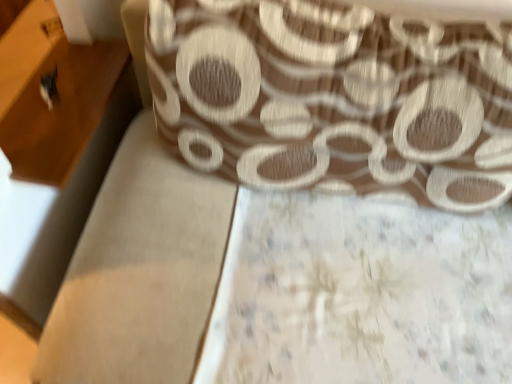
Question: From the image's perspective, is brown textured fabric at upper center located beneath wooden drawer at left?

Choices:
 (A) yes
 (B) no

Answer: (A)

Question: From a real-world perspective, does brown textured fabric at upper center stand above wooden drawer at left?

Choices:
 (A) yes
 (B) no

Answer: (A)

Question: Is brown textured fabric at upper center closer to camera compared to wooden drawer at left?

Choices:
 (A) no
 (B) yes

Answer: (B)

Question: Is brown textured fabric at upper center positioned far away from wooden drawer at left?

Choices:
 (A) yes
 (B) no

Answer: (B)

Question: Is wooden drawer at left a part of brown textured fabric at upper center?

Choices:
 (A) yes
 (B) no

Answer: (B)

Question: Can we say brown textured fabric at upper center lies outside wooden drawer at left?

Choices:
 (A) no
 (B) yes

Answer: (B)

Question: From the image's perspective, is wooden drawer at left on brown textured fabric at upper center?

Choices:
 (A) yes
 (B) no

Answer: (A)

Question: Considering the relative positions of wooden drawer at left and brown textured fabric at upper center in the image provided, is wooden drawer at left to the right of brown textured fabric at upper center from the viewer's perspective?

Choices:
 (A) yes
 (B) no

Answer: (B)

Question: From a real-world perspective, is wooden drawer at left physically below brown textured fabric at upper center?

Choices:
 (A) yes
 (B) no

Answer: (A)

Question: Is the depth of wooden drawer at left greater than that of brown textured fabric at upper center?

Choices:
 (A) yes
 (B) no

Answer: (A)

Question: Is wooden drawer at left positioned before brown textured fabric at upper center?

Choices:
 (A) yes
 (B) no

Answer: (B)

Question: Is wooden drawer at left surrounding brown textured fabric at upper center?

Choices:
 (A) yes
 (B) no

Answer: (B)

Question: From a real-world perspective, is wooden drawer at left above or below brown textured fabric at upper center?

Choices:
 (A) above
 (B) below

Answer: (B)